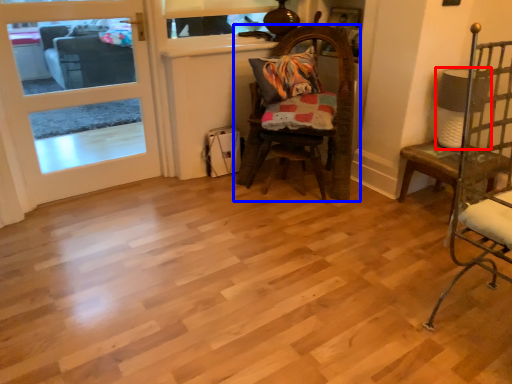
Question: Which object appears closest to the camera in this image, lamp (highlighted by a red box) or chair (highlighted by a blue box)?

Choices:
 (A) lamp
 (B) chair

Answer: (B)